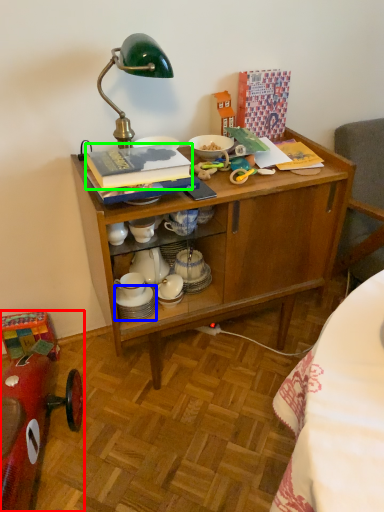
Question: Considering the real-world distances, which object is closest to model car (highlighted by a red box)? tableware (highlighted by a blue box) or book (highlighted by a green box).

Choices:
 (A) tableware
 (B) book

Answer: (A)